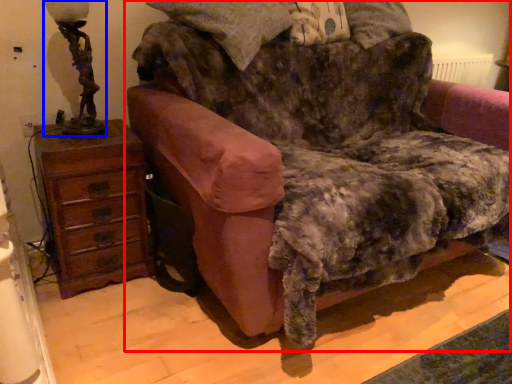
Question: Which of the following is the closest to the observer, furniture (highlighted by a red box) or table lamp (highlighted by a blue box)?

Choices:
 (A) furniture
 (B) table lamp

Answer: (A)